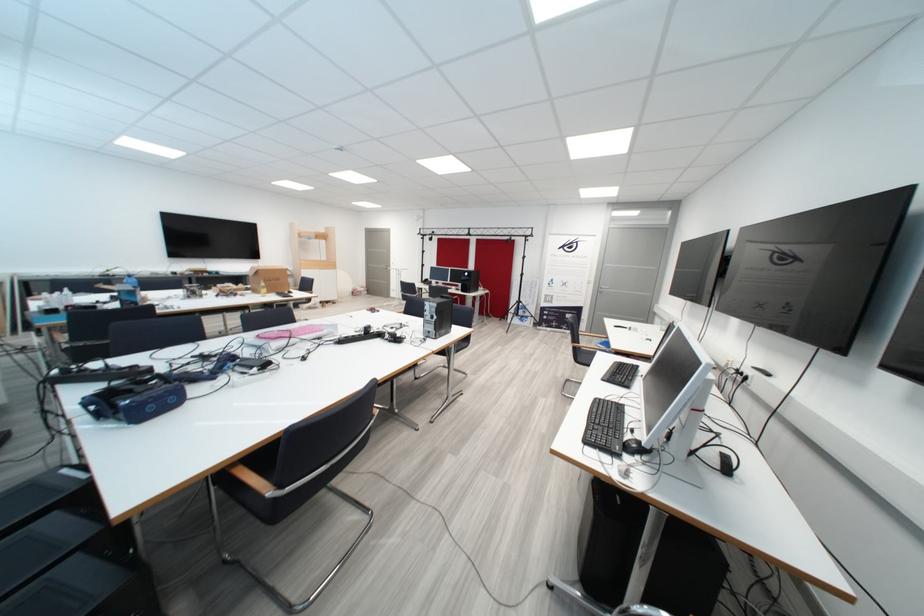
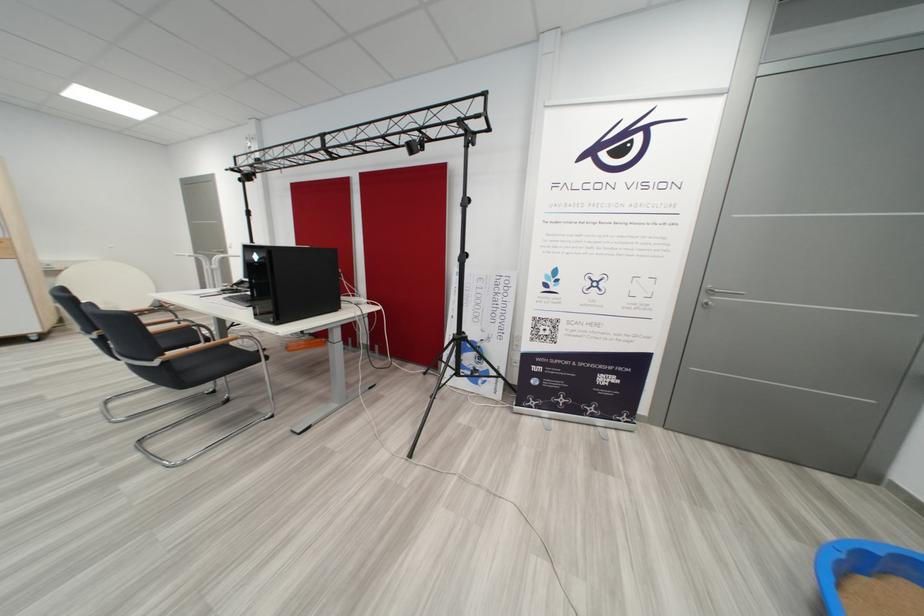
Question: The images are taken continuously from a first-person perspective. In which direction are you moving?

Choices:
 (A) Left
 (B) Right
 (C) Forward
 (D) Backward

Answer: (C)